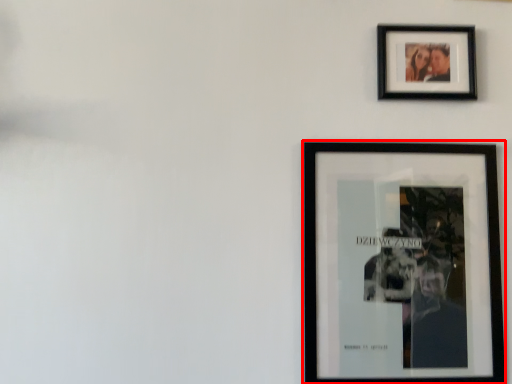
Question: From the image's perspective, what is the correct spatial positioning of picture frame (annotated by the red box) in reference to picture frame?

Choices:
 (A) above
 (B) below

Answer: (B)